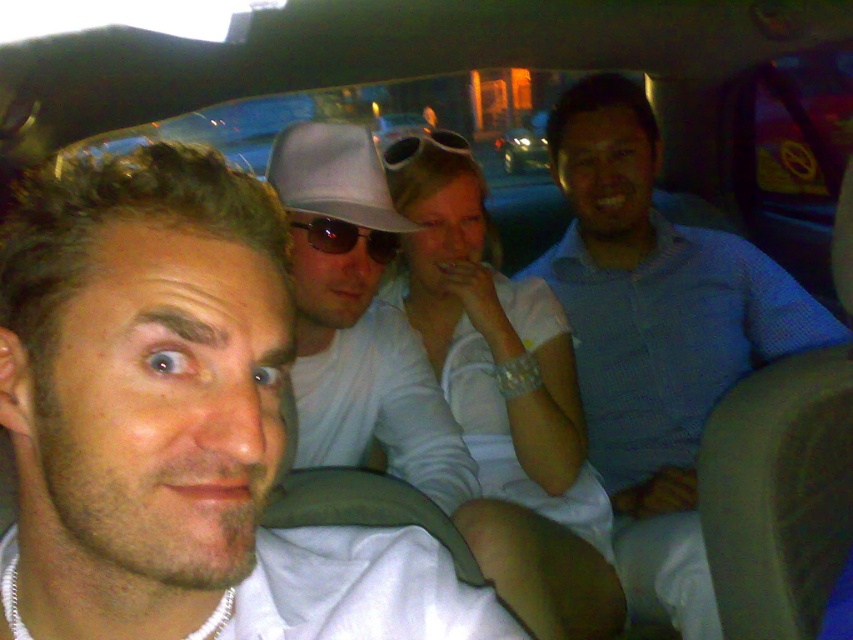
In the scene shown: You are sitting in a car at night and want to reach a point marked at coordinates point [370,237]. If your arm can extend 1.2 meters, can you comfortably reach that point?

The distance of point [370,237] from viewer is 1.23 meters, so your arm can only extend 1.2 meters, meaning you cannot comfortably reach the point [370,237].

You are a passenger in a car at night. You see the smooth white shirt at center and the green matte car at center. Which object is closer to the left side of the car?

The smooth white shirt at center is closer to the left side of the car because it is positioned to the left of the green matte car at center.

You are standing 1.5 meters away from the car. You want to take a photo of the matte white baseball hat at center inside the car. Can you reach it with your phone camera without moving closer than 1.5 meters?

The matte white baseball hat at center is 1.14 meters away from the camera, which is within the 1.5 meters distance you are standing. Therefore, you can take the photo without moving closer than 1.5 meters.